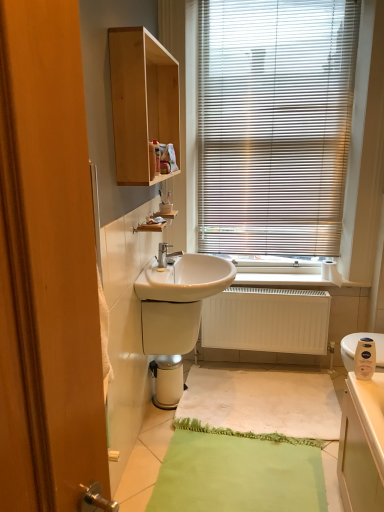
The height and width of the screenshot is (512, 384). In order to click on white matte radiator at lower center in this screenshot , I will do `click(267, 320)`.

What do you see at coordinates (267, 320) in the screenshot? I see `white matte radiator at lower center` at bounding box center [267, 320].

Measure the distance between white matte toilet paper at right and camera.

white matte toilet paper at right and camera are 2.76 meters apart.

What do you see at coordinates (274, 124) in the screenshot? I see `metallic blinds at upper right` at bounding box center [274, 124].

In the scene shown: Measure the distance between point (349, 58) and camera.

Point (349, 58) and camera are 2.46 meters apart from each other.

Identify the location of matte plastic soap dispenser at lower right. pos(365,359).

Where is `white glossy water heater at lower center`? Image resolution: width=384 pixels, height=512 pixels. white glossy water heater at lower center is located at coordinates (167, 380).

Identify the location of white matte radiator at lower center. This screenshot has width=384, height=512. (267, 320).

Considering the positions of objects white fabric bath mat at center and wooden cabinet at left in the image provided, who is more to the left, white fabric bath mat at center or wooden cabinet at left?

From the viewer's perspective, wooden cabinet at left appears more on the left side.

Based on the photo, how far apart are white fabric bath mat at center and wooden cabinet at left?

white fabric bath mat at center and wooden cabinet at left are 6.13 feet apart from each other.

Which object is wider, white fabric bath mat at center or wooden cabinet at left?

white fabric bath mat at center.

Considering the relative sizes of white fabric bath mat at center and wooden cabinet at left in the image provided, is white fabric bath mat at center bigger than wooden cabinet at left?

No, white fabric bath mat at center is not bigger than wooden cabinet at left.

Does point (176, 356) lie behind point (327, 264)?

No, it is in front of (327, 264).

From the picture: Considering the relative positions of white glossy water heater at lower center and white matte toilet paper at right in the image provided, is white glossy water heater at lower center to the right of white matte toilet paper at right from the viewer's perspective?

No.

Is white glossy water heater at lower center bigger or smaller than white matte toilet paper at right?

Clearly, white glossy water heater at lower center is larger in size than white matte toilet paper at right.

Is white glossy water heater at lower center not inside white matte toilet paper at right?

Absolutely, white glossy water heater at lower center is external to white matte toilet paper at right.

Between point (160, 245) and point (249, 407), which one is positioned behind?

The point (249, 407) is farther.

From the image's perspective, is silver metallic tap at center above or below white fabric bath mat at center?

Based on their image positions, silver metallic tap at center is located above white fabric bath mat at center.

Which of these two, silver metallic tap at center or white fabric bath mat at center, is thinner?

Thinner between the two is silver metallic tap at center.

Considering the relative sizes of silver metallic tap at center and white fabric bath mat at center in the image provided, is silver metallic tap at center smaller than white fabric bath mat at center?

Yes.

Does point (330, 266) come closer to viewer compared to point (365, 350)?

No, (330, 266) is further to viewer.

Considering the sizes of objects white matte toilet paper at right and matte plastic soap dispenser at lower right in the image provided, who is taller, white matte toilet paper at right or matte plastic soap dispenser at lower right?

With more height is matte plastic soap dispenser at lower right.

From a real-world perspective, is white matte toilet paper at right beneath matte plastic soap dispenser at lower right?

No, from a real-world perspective, white matte toilet paper at right is not below matte plastic soap dispenser at lower right.

Would you say white matte toilet paper at right is outside matte plastic soap dispenser at lower right?

white matte toilet paper at right is positioned outside matte plastic soap dispenser at lower right.

Between point (164, 262) and point (230, 96), which one is positioned behind?

Point (230, 96)

Based on their positions, is silver metallic tap at center located to the left or right of metallic blinds at upper right?

Based on their positions, silver metallic tap at center is located to the left of metallic blinds at upper right.

Is silver metallic tap at center not close to metallic blinds at upper right?

Yes, silver metallic tap at center and metallic blinds at upper right are located far from each other.

From a real-world perspective, relative to metallic blinds at upper right, is silver metallic tap at center vertically above or below?

silver metallic tap at center is situated lower than metallic blinds at upper right in the real world.

How distant is metallic blinds at upper right from white glossy water heater at lower center?

metallic blinds at upper right and white glossy water heater at lower center are 4.78 feet apart from each other.

Does point (253, 241) come closer to viewer compared to point (169, 400)?

No.

Relative to white glossy water heater at lower center, is metallic blinds at upper right in front or behind?

metallic blinds at upper right is positioned closer to the viewer than white glossy water heater at lower center.

Is metallic blinds at upper right situated inside white glossy water heater at lower center or outside?

metallic blinds at upper right cannot be found inside white glossy water heater at lower center.

Considering the relative sizes of light wood cabinet at upper center and matte plastic soap dispenser at lower right in the image provided, is light wood cabinet at upper center smaller than matte plastic soap dispenser at lower right?

No, light wood cabinet at upper center is not smaller than matte plastic soap dispenser at lower right.

From the image's perspective, relative to matte plastic soap dispenser at lower right, is light wood cabinet at upper center above or below?

Clearly, from the image's perspective, light wood cabinet at upper center is above matte plastic soap dispenser at lower right.

Considering their positions, is light wood cabinet at upper center located in front of or behind matte plastic soap dispenser at lower right?

light wood cabinet at upper center is positioned closer to the viewer than matte plastic soap dispenser at lower right.

Considering the positions of objects light wood cabinet at upper center and matte plastic soap dispenser at lower right in the image provided, who is more to the left, light wood cabinet at upper center or matte plastic soap dispenser at lower right?

From the viewer's perspective, light wood cabinet at upper center appears more on the left side.

Identify the location of screen door in front of the white fabric bath mat at center. Image resolution: width=384 pixels, height=512 pixels. (46, 266).

In order to click on water heater located underneath the white matte toilet paper at right (from a real-world perspective) in this screenshot , I will do `click(167, 380)`.

Which object lies nearer to the anchor point white glossy water heater at lower center, white matte toilet paper at right or wooden cabinet at left?

white matte toilet paper at right lies closer to white glossy water heater at lower center than the other object.

When comparing their distances from white matte radiator at lower center, does white glossy water heater at lower center or metallic blinds at upper right seem further?

metallic blinds at upper right is positioned further to the anchor white matte radiator at lower center.

Which object lies nearer to the anchor point silver metallic tap at center, matte plastic soap dispenser at lower right or white glossy water heater at lower center?

white glossy water heater at lower center is closer to silver metallic tap at center.

Looking at the image, which one is located closer to white glossy water heater at lower center, silver metallic tap at center or white matte toilet paper at right?

silver metallic tap at center is positioned closer to the anchor white glossy water heater at lower center.

Considering their positions, is white glossy water heater at lower center positioned closer to light wood cabinet at upper center than silver metallic tap at center?

Among the two, silver metallic tap at center is located nearer to light wood cabinet at upper center.

From the image, which object appears to be farther from matte plastic soap dispenser at lower right, wooden cabinet at left or white matte radiator at lower center?

Among the two, wooden cabinet at left is located further to matte plastic soap dispenser at lower right.

From the image, which object appears to be farther from metallic blinds at upper right, white fabric bath mat at center or light wood cabinet at upper center?

white fabric bath mat at center lies further to metallic blinds at upper right than the other object.

Considering their positions, is matte plastic soap dispenser at lower right positioned further to silver metallic tap at center than wooden cabinet at left?

wooden cabinet at left lies further to silver metallic tap at center than the other object.

Locate an element on the screen. This screenshot has width=384, height=512. sink positioned between matte plastic soap dispenser at lower right and white matte radiator at lower center from near to far is located at coordinates (178, 300).

This screenshot has height=512, width=384. What are the coordinates of `water heater between wooden cabinet at left and white matte radiator at lower center in the front-back direction` in the screenshot? It's located at (167, 380).

Locate an element on the screen. Image resolution: width=384 pixels, height=512 pixels. bathroom cabinet between metallic blinds at upper right and silver metallic tap at center vertically is located at coordinates [x=142, y=102].

You are a GUI agent. You are given a task and a screenshot of the screen. Output one action in this format:
    pyautogui.click(x=<x>, y=<y>)
    Task: Click on the sink that lies between silver metallic tap at center and white fabric bath mat at center from top to bottom
    The width and height of the screenshot is (384, 512).
    Given the screenshot: What is the action you would take?
    pyautogui.click(x=178, y=300)